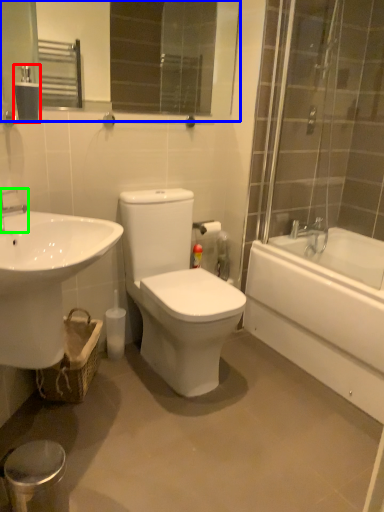
Question: Based on their relative distances, which object is nearer to tissue (highlighted by a red box)? Choose from mirror (highlighted by a blue box) and tap (highlighted by a green box).

Choices:
 (A) mirror
 (B) tap

Answer: (B)